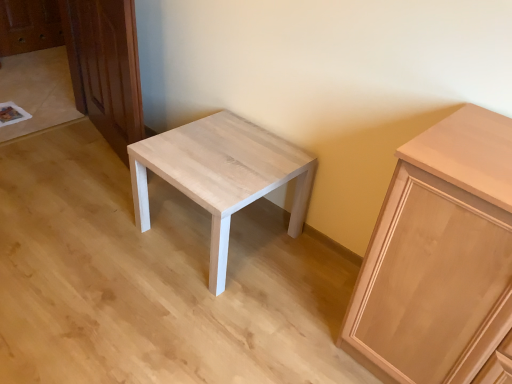
Identify the location of free point above light wood/texture stool at center (from a real-world perspective). (228, 153).